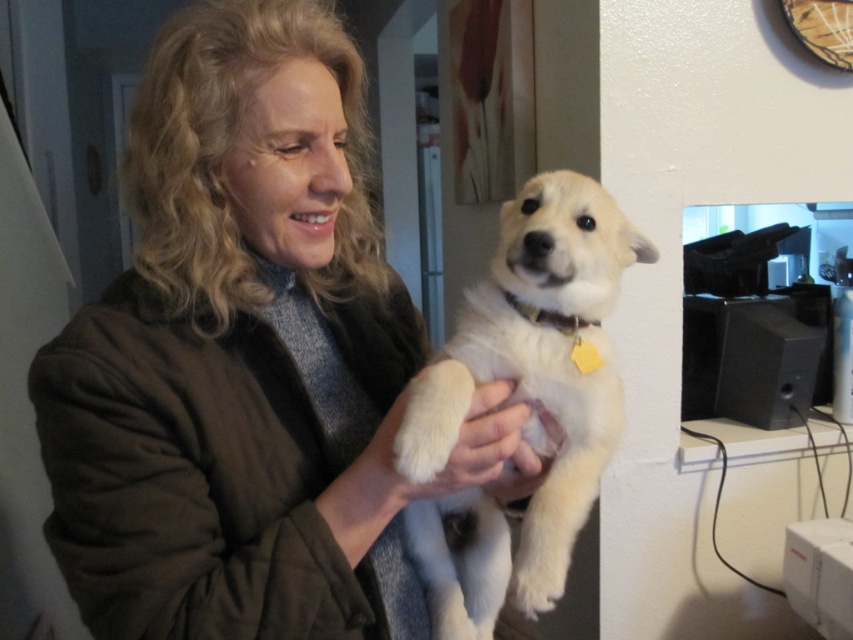
Between point (241, 547) and point (462, 492), which one is positioned behind?

The point (462, 492) is behind.

Between matte brown jacket at center and white fluffy dog at center, which one appears on the left side from the viewer's perspective?

matte brown jacket at center is more to the left.

Identify the location of matte brown jacket at center. (247, 358).